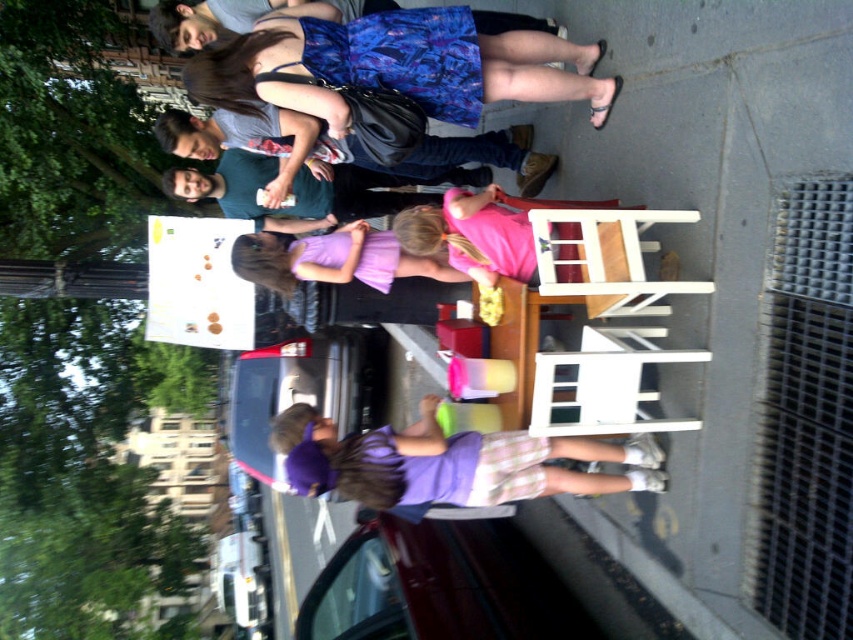
Question: Which object appears closest to the camera in this image?

Choices:
 (A) white wood chair at right
 (B) printed fabric dress at upper center

Answer: (A)

Question: Does printed fabric dress at upper center appear on the right side of purple fabric dress at center?

Choices:
 (A) yes
 (B) no

Answer: (A)

Question: Considering the relative positions of printed fabric dress at upper center and pink matte chair at center in the image provided, where is printed fabric dress at upper center located with respect to pink matte chair at center?

Choices:
 (A) right
 (B) left

Answer: (B)

Question: Which point is closer to the camera?

Choices:
 (A) (598, 276)
 (B) (408, 61)
 (C) (585, 452)

Answer: (A)

Question: Is purple cotton dress at center to the right of pink matte chair at center from the viewer's perspective?

Choices:
 (A) no
 (B) yes

Answer: (A)

Question: Estimate the real-world distances between objects in this image. Which object is closer to the white wood chair at right?

Choices:
 (A) printed fabric dress at upper center
 (B) pink matte chair at center
 (C) purple fabric dress at center

Answer: (B)